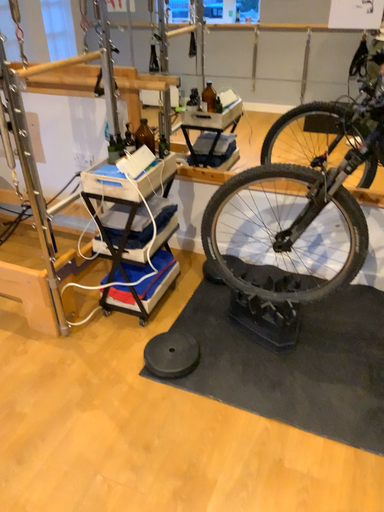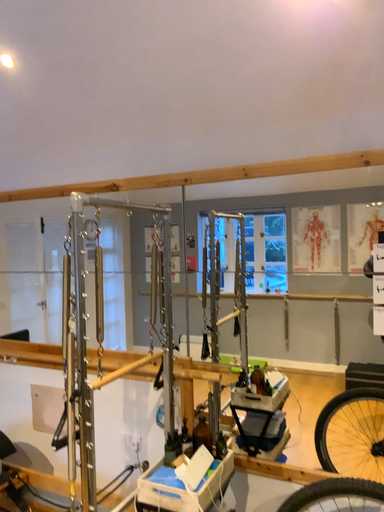
Question: How did the camera likely rotate when shooting the video?

Choices:
 (A) rotated downward
 (B) rotated upward

Answer: (B)